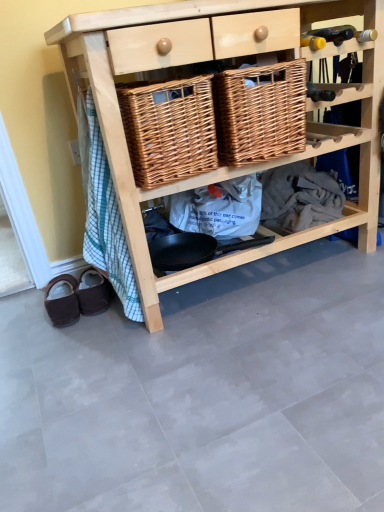
Question: Looking at the image, does woven brown basket at center, acting as the second basket starting from the left, seem bigger or smaller compared to natural wood shelf at center?

Choices:
 (A) small
 (B) big

Answer: (A)

Question: From a real-world perspective, is woven brown basket at center, the first basket viewed from the right, physically located above or below natural wood shelf at center?

Choices:
 (A) below
 (B) above

Answer: (B)

Question: Which of these objects is positioned farthest from the natural wood shelf at center?

Choices:
 (A) woven brown basket at center, marked as the second basket in a right-to-left arrangement
 (B) brown suede mule at lower left, which is counted as the second footwear, starting from the left
 (C) woven brown basket at center, the first basket viewed from the right
 (D) brown suede slippers at lower left, the second footwear from the right

Answer: (D)

Question: Which object is the farthest from the woven brown basket at center, acting as the second basket starting from the left?

Choices:
 (A) natural wood shelf at center
 (B) brown suede mule at lower left, which is counted as the second footwear, starting from the left
 (C) woven brown basket at center, marked as the second basket in a right-to-left arrangement
 (D) brown suede slippers at lower left, the second footwear from the right

Answer: (D)